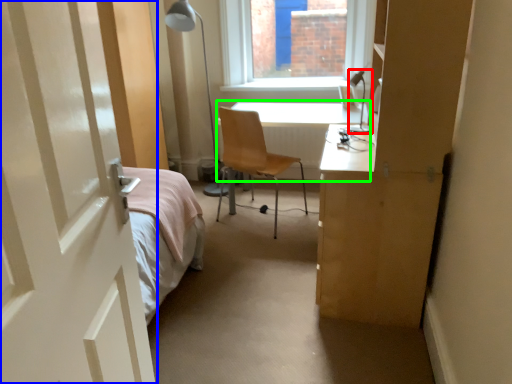
Question: Based on their relative distances, which object is nearer to table lamp (highlighted by a red box)? Choose from door (highlighted by a blue box) and table (highlighted by a green box).

Choices:
 (A) door
 (B) table

Answer: (B)